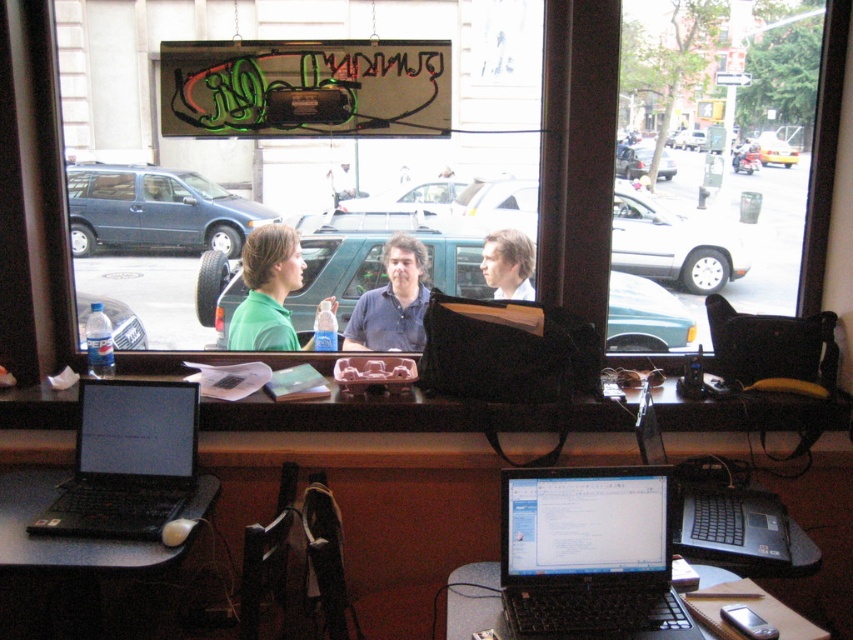
Can you confirm if black matte laptop at lower left is positioned to the left of smooth brown hair at center?

Correct, you'll find black matte laptop at lower left to the left of smooth brown hair at center.

Consider the image. Does black matte laptop at lower left have a larger size compared to smooth brown hair at center?

Yes, black matte laptop at lower left is bigger than smooth brown hair at center.

This screenshot has height=640, width=853. Find the location of `black matte laptop at lower left`. black matte laptop at lower left is located at coordinates (126, 460).

Between black plastic laptop at lower right and smooth brown hair at center, which one appears on the right side from the viewer's perspective?

black plastic laptop at lower right is more to the right.

Is black plastic laptop at lower right shorter than smooth brown hair at center?

Incorrect, black plastic laptop at lower right's height does not fall short of smooth brown hair at center's.

I want to click on black plastic laptop at lower right, so click(735, 518).

Does black plastic laptop at lower center lie behind matte blue shirt at center?

No.

Which is behind, point (486, 595) or point (352, 340)?

Point (352, 340)

Between point (469, 573) and point (396, 285), which one is positioned behind?

Point (396, 285)

What are the coordinates of `black plastic laptop at lower center` in the screenshot? It's located at pyautogui.click(x=474, y=602).